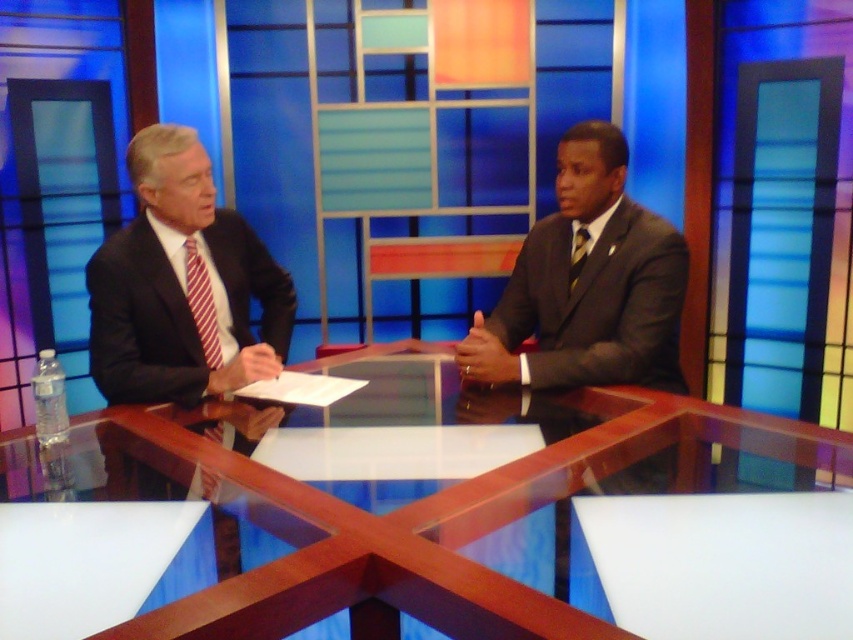
You are a camera operator in a TV studio. You need to frame a closeup shot of both the matte black suit at right and the red striped tie at left. Based on their positions, which one should you adjust the camera to focus on first?

The matte black suit at right is positioned on the right side of the red striped tie at left, so you should focus on the red striped tie at left first to ensure both are in frame.

You are a costume designer preparing for a TV show. You need to ensure that the matte black suit at right and the red striped tie at left are visible to the audience. Based on their sizes, which one is more likely to be easily seen from the camera angle in the studio?

The matte black suit at right is taller than the red striped tie at left, so it is more likely to be easily seen from the camera angle in the studio.